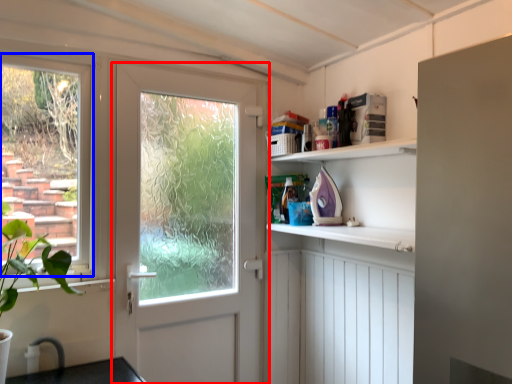
Question: Which point is closer to the camera, door (highlighted by a red box) or window (highlighted by a blue box)?

Choices:
 (A) door
 (B) window

Answer: (B)